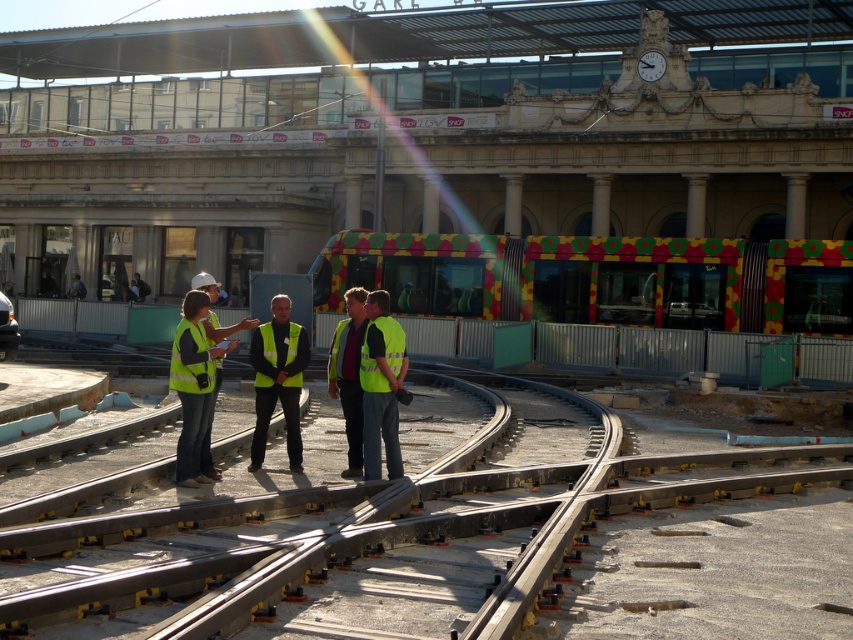
Locate an element on the screen. This screenshot has height=640, width=853. yellow reflective vest at center is located at coordinates (381, 387).

Is yellow reflective vest at center thinner than yellow reflective safety vest at center?

Indeed, yellow reflective vest at center has a lesser width compared to yellow reflective safety vest at center.

Image resolution: width=853 pixels, height=640 pixels. In order to click on yellow reflective vest at center in this screenshot , I will do `click(381, 387)`.

You are a GUI agent. You are given a task and a screenshot of the screen. Output one action in this format:
    pyautogui.click(x=<x>, y=<y>)
    Task: Click on the yellow reflective vest at center
    
    Given the screenshot: What is the action you would take?
    pyautogui.click(x=381, y=387)

Between high visibility yellow safety vest at center and bright yellow reflective safety vest at center, which one appears on the left side from the viewer's perspective?

high visibility yellow safety vest at center is more to the left.

Find the location of a particular element. The height and width of the screenshot is (640, 853). high visibility yellow safety vest at center is located at coordinates (190, 358).

Between bright yellow reflective safety vest at center and yellow reflective safety vest at center, which one is positioned lower?

bright yellow reflective safety vest at center is lower down.

Is bright yellow reflective safety vest at center closer to the viewer compared to yellow reflective safety vest at center?

Yes, bright yellow reflective safety vest at center is closer to the viewer.

This screenshot has width=853, height=640. In order to click on bright yellow reflective safety vest at center in this screenshot , I will do `click(390, 340)`.